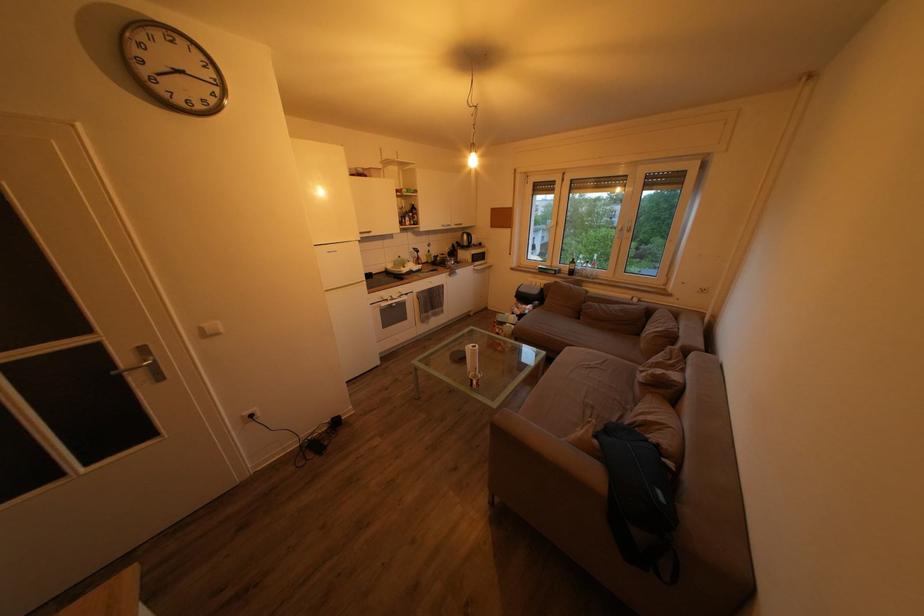
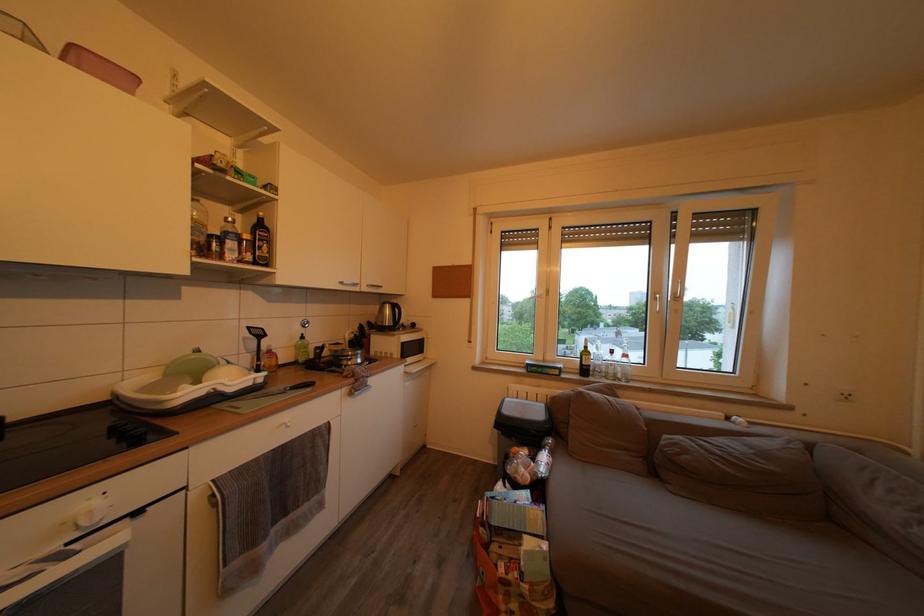
Find the pixel in the second image that matches (441,262) in the first image.

(320, 353)